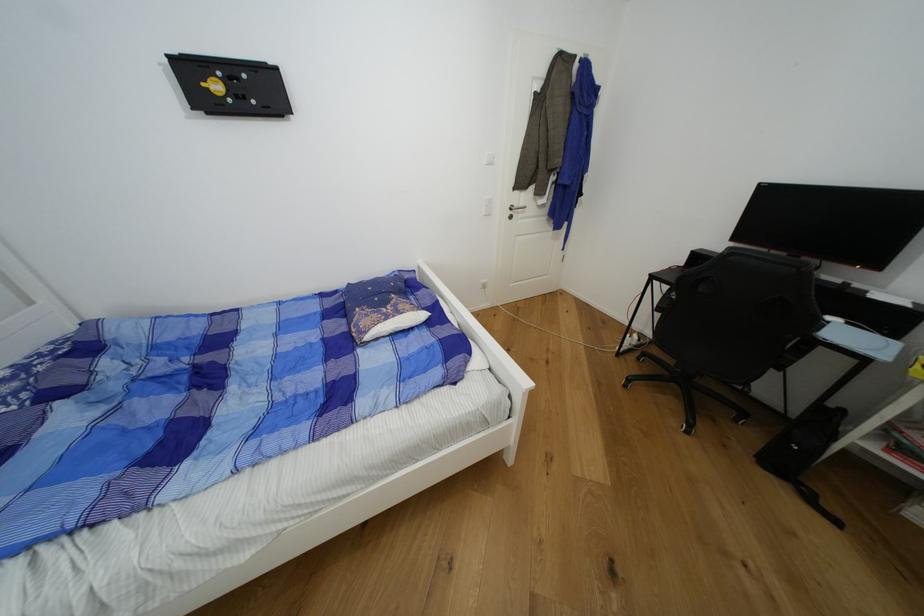
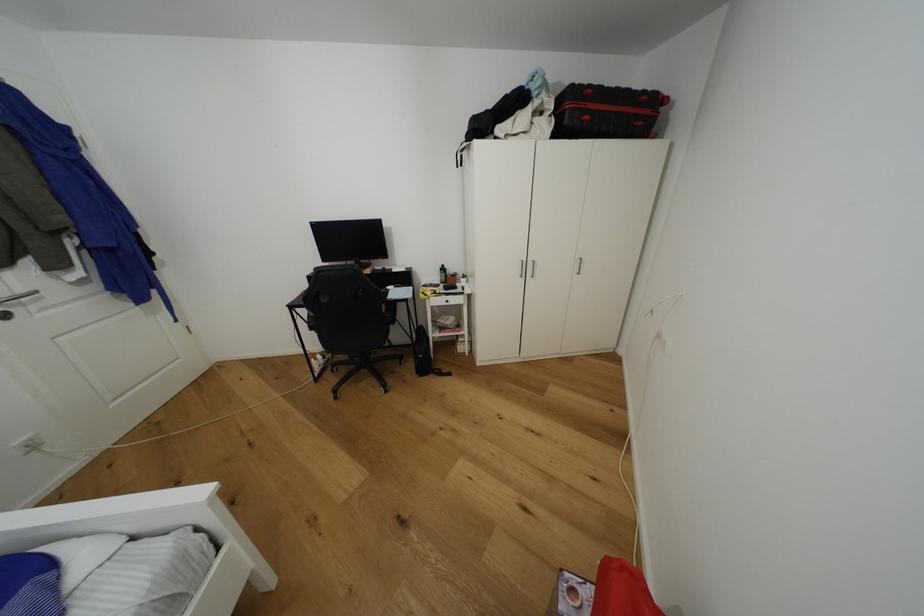
Question: The first image is from the beginning of the video and the second image is from the end. How did the camera likely rotate when shooting the video?

Choices:
 (A) Left
 (B) Right
 (C) Up
 (D) Down

Answer: (B)